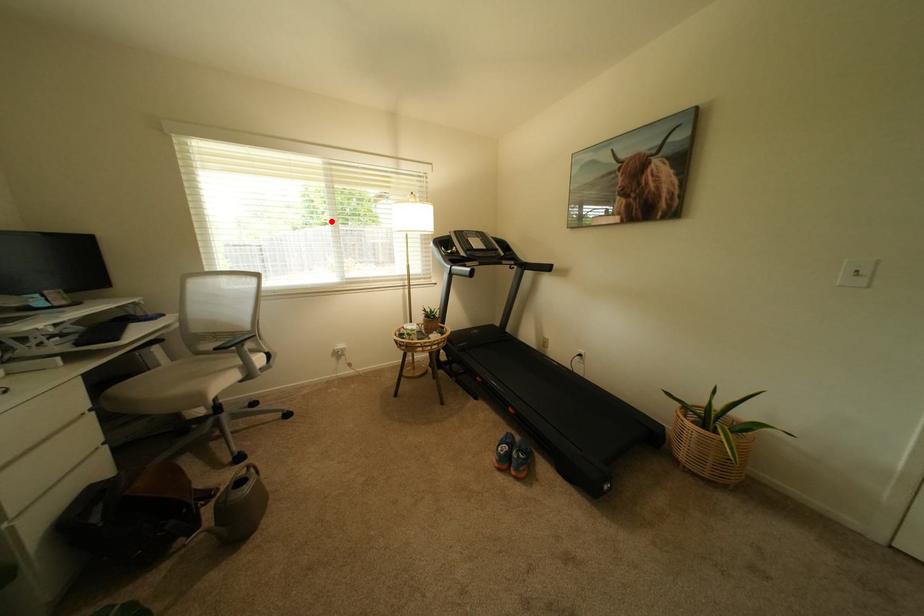
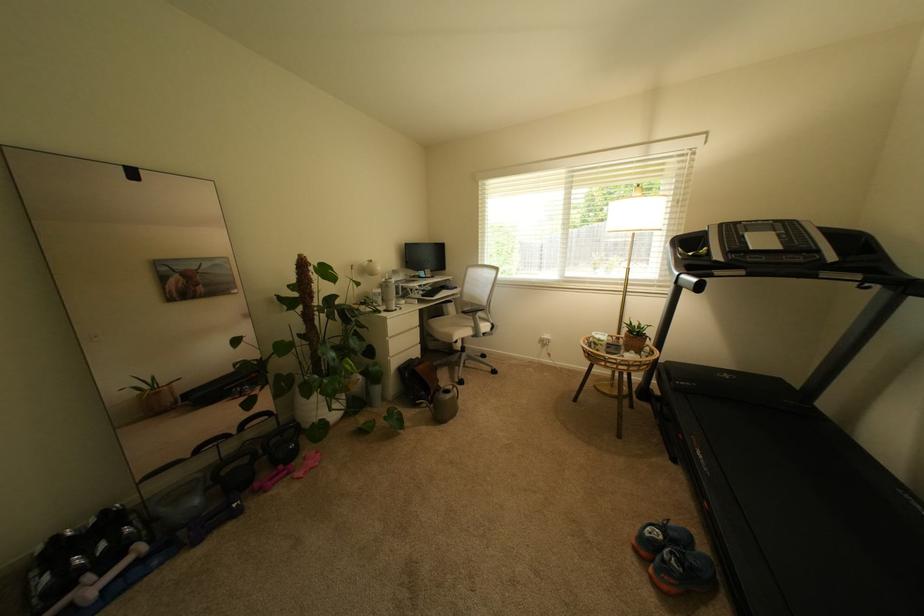
Where in the second image is the point corresponding to the highlighted location from the first image?

(608, 217)